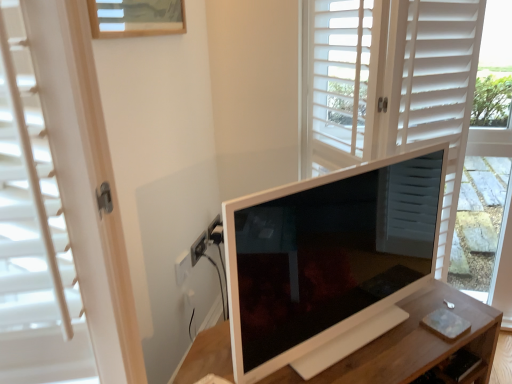
Question: Can you confirm if wooden drawer at lower right is bigger than white wooden table at center?

Choices:
 (A) no
 (B) yes

Answer: (A)

Question: Is wooden drawer at lower right positioned far away from white wooden table at center?

Choices:
 (A) yes
 (B) no

Answer: (B)

Question: Does wooden drawer at lower right have a lesser height compared to white wooden table at center?

Choices:
 (A) yes
 (B) no

Answer: (A)

Question: Does wooden drawer at lower right lie in front of white wooden table at center?

Choices:
 (A) no
 (B) yes

Answer: (A)

Question: Is wooden drawer at lower right aimed at white wooden table at center?

Choices:
 (A) yes
 (B) no

Answer: (A)

Question: Considering the positions of point click(386, 337) and point click(448, 223), is point click(386, 337) closer or farther from the camera than point click(448, 223)?

Choices:
 (A) closer
 (B) farther

Answer: (A)

Question: Is white wooden table at center wider or thinner than matte white screen door at center?

Choices:
 (A) wide
 (B) thin

Answer: (B)

Question: Is white wooden table at center in front of or behind matte white screen door at center in the image?

Choices:
 (A) behind
 (B) front

Answer: (B)

Question: Based on their positions, is white wooden table at center located to the left or right of matte white screen door at center?

Choices:
 (A) right
 (B) left

Answer: (B)

Question: Is white glossy monitor at center wider or thinner than matte white screen door at center?

Choices:
 (A) thin
 (B) wide

Answer: (A)

Question: Considering the positions of white glossy monitor at center and matte white screen door at center in the image, is white glossy monitor at center taller or shorter than matte white screen door at center?

Choices:
 (A) tall
 (B) short

Answer: (B)

Question: Is point (359, 284) positioned closer to the camera than point (477, 62)?

Choices:
 (A) closer
 (B) farther

Answer: (A)

Question: Considering the positions of white glossy monitor at center and matte white screen door at center in the image, is white glossy monitor at center bigger or smaller than matte white screen door at center?

Choices:
 (A) big
 (B) small

Answer: (B)

Question: Considering their positions, is white glossy monitor at center located in front of or behind wooden drawer at lower right?

Choices:
 (A) behind
 (B) front

Answer: (B)

Question: Considering the positions of point (314, 243) and point (452, 382), is point (314, 243) closer or farther from the camera than point (452, 382)?

Choices:
 (A) farther
 (B) closer

Answer: (B)